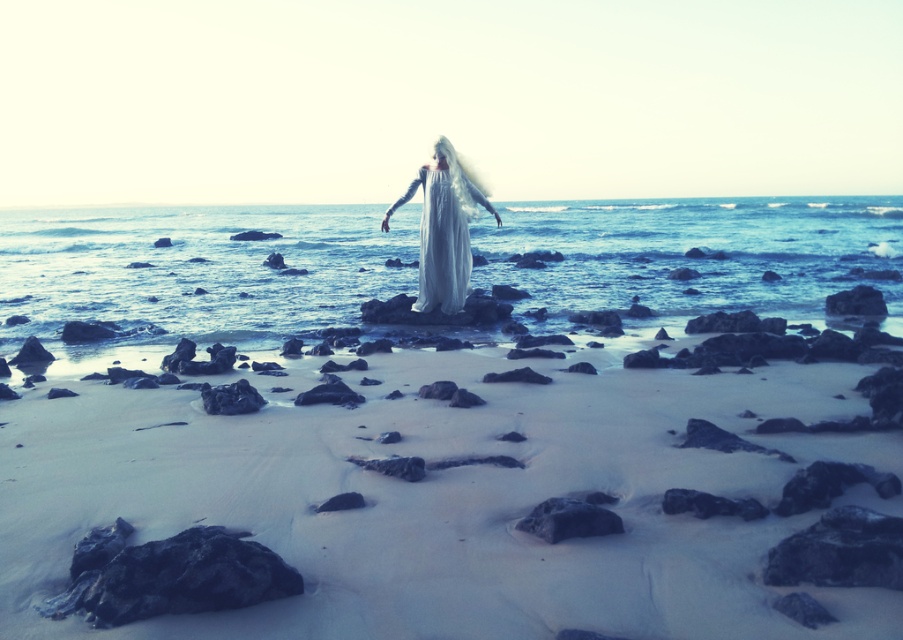
Question: Does translucent white water at center have a lesser width compared to smooth gray rock at center?

Choices:
 (A) yes
 (B) no

Answer: (B)

Question: Considering the real-world distances, which object is farthest from the translucent white water at center?

Choices:
 (A) smooth gray rock at center
 (B) white sand at center
 (C) white silk dress at center

Answer: (B)

Question: Can you confirm if translucent white water at center is positioned to the right of white silk dress at center?

Choices:
 (A) yes
 (B) no

Answer: (A)

Question: Which of these objects is positioned farthest from the white sand at center?

Choices:
 (A) white silk dress at center
 (B) smooth gray rock at center
 (C) translucent white water at center

Answer: (C)

Question: Is white sand at center below white silk dress at center?

Choices:
 (A) no
 (B) yes

Answer: (B)

Question: Which point is farther from the camera taking this photo?

Choices:
 (A) (478, 524)
 (B) (455, 228)
 (C) (547, 499)
 (D) (63, 300)

Answer: (D)